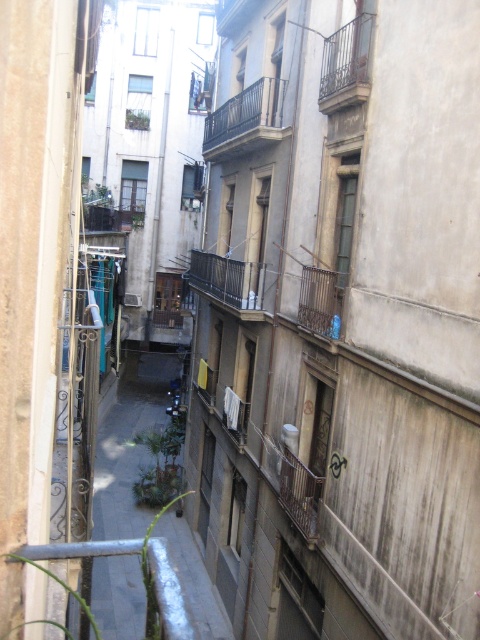
Question: Which point is farther from the camera taking this photo?

Choices:
 (A) (199, 260)
 (B) (145, 428)

Answer: (B)

Question: Can you confirm if black wrought iron balcony at center is positioned above rusty metal balcony at upper center?

Choices:
 (A) no
 (B) yes

Answer: (B)

Question: Does black wrought iron balcony at center have a smaller size compared to rusty metal balcony at upper center?

Choices:
 (A) no
 (B) yes

Answer: (B)

Question: Which object is farther from the camera taking this photo?

Choices:
 (A) green leafy plant at center
 (B) rustic metal balcony at center
 (C) rusty metal balcony at upper center
 (D) black wrought iron balcony at center

Answer: (B)

Question: In this image, where is black wrought iron balcony at center located relative to rusty metal balcony at upper center?

Choices:
 (A) left
 (B) right

Answer: (A)

Question: Which of the following is the closest to the observer?

Choices:
 (A) (157, 506)
 (B) (231, 134)

Answer: (B)